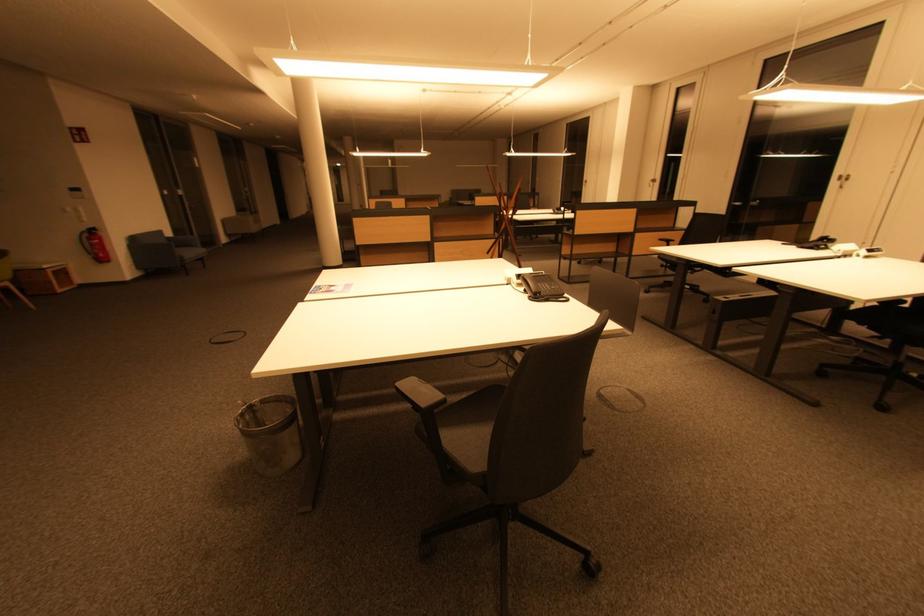
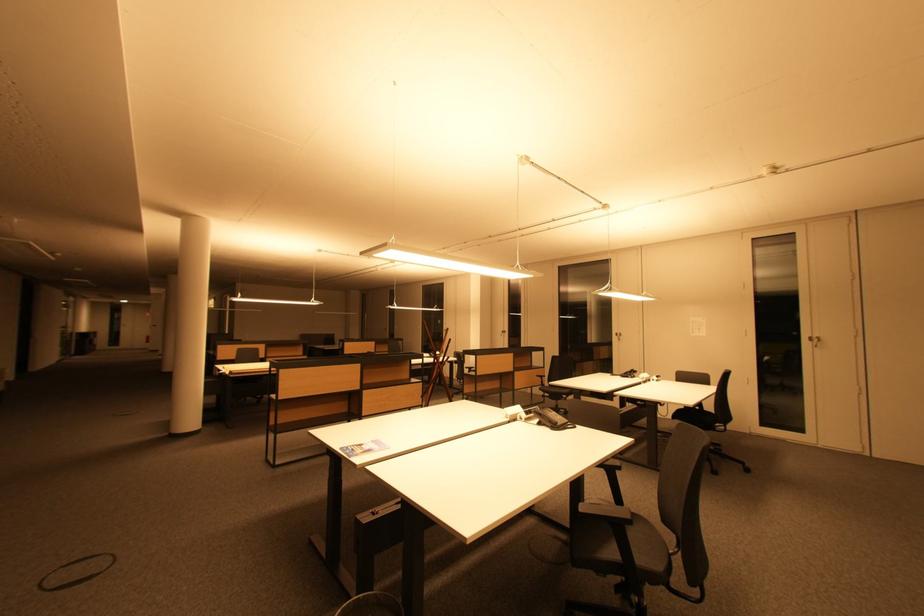
The point at (527, 349) is marked in the first image. Where is the corresponding point in the second image?

(610, 466)